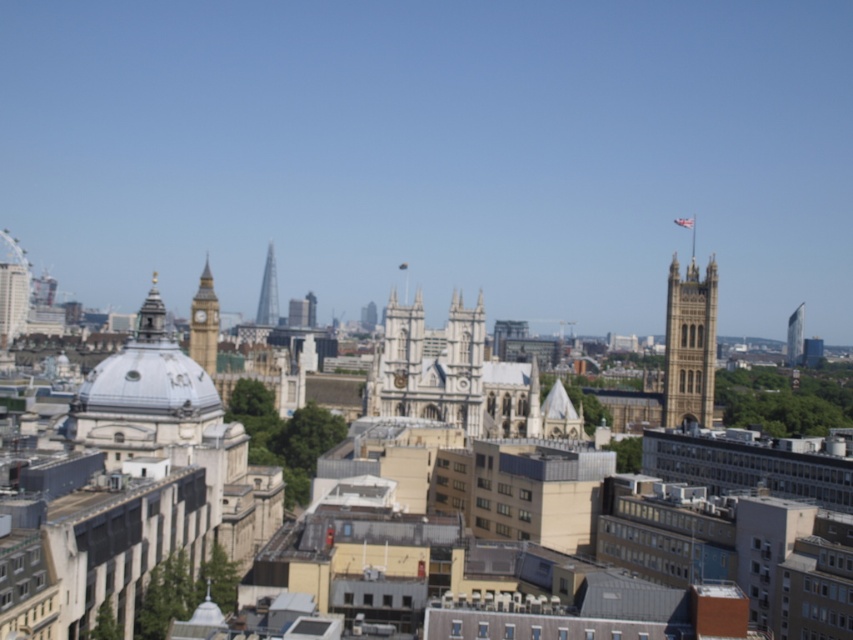
You are a tourist standing in the city square, looking at the golden stone tower at upper right and the golden stone clock tower at left. Which one is closer to you?

The golden stone tower at upper right is closer to you because it is in front of the golden stone clock tower at left.

You are an architect analyzing the cityscape. You observe the golden stone clock tower at left and the glassy steel tower at center. Which structure is taller? Please provide your conclusion based on the architectural details visible in the image.

The golden stone clock tower at left is taller than the glassy steel tower at center.